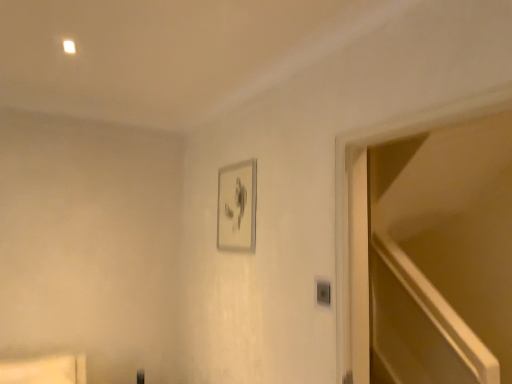
Question: Is silver metallic picture frame at upper center a part of transparent glass door at right?

Choices:
 (A) yes
 (B) no

Answer: (B)

Question: From the image's perspective, does transparent glass door at right appear higher than silver metallic picture frame at upper center?

Choices:
 (A) yes
 (B) no

Answer: (B)

Question: From a real-world perspective, is transparent glass door at right physically above silver metallic picture frame at upper center?

Choices:
 (A) no
 (B) yes

Answer: (A)

Question: From a real-world perspective, is transparent glass door at right under silver metallic picture frame at upper center?

Choices:
 (A) no
 (B) yes

Answer: (B)

Question: Considering the relative sizes of transparent glass door at right and silver metallic picture frame at upper center in the image provided, is transparent glass door at right bigger than silver metallic picture frame at upper center?

Choices:
 (A) yes
 (B) no

Answer: (A)

Question: Is transparent glass door at right far away from silver metallic picture frame at upper center?

Choices:
 (A) yes
 (B) no

Answer: (A)

Question: Is matte wood shelf at lower left aimed at transparent glass door at right?

Choices:
 (A) no
 (B) yes

Answer: (A)

Question: Is matte wood shelf at lower left thinner than transparent glass door at right?

Choices:
 (A) no
 (B) yes

Answer: (A)

Question: From the image's perspective, would you say matte wood shelf at lower left is shown under transparent glass door at right?

Choices:
 (A) yes
 (B) no

Answer: (A)

Question: Is matte wood shelf at lower left to the left of transparent glass door at right from the viewer's perspective?

Choices:
 (A) no
 (B) yes

Answer: (B)

Question: Does matte wood shelf at lower left appear on the right side of transparent glass door at right?

Choices:
 (A) yes
 (B) no

Answer: (B)

Question: Is matte wood shelf at lower left shorter than transparent glass door at right?

Choices:
 (A) yes
 (B) no

Answer: (A)

Question: From a real-world perspective, is silver metallic picture frame at upper center physically above matte wood shelf at lower left?

Choices:
 (A) yes
 (B) no

Answer: (A)